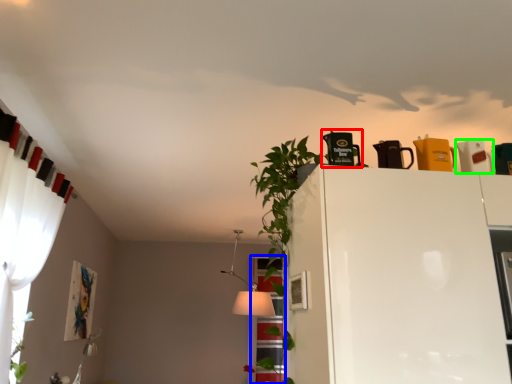
Question: Which is nearer to the appliance (highlighted by a red box)? window (highlighted by a blue box) or appliance (highlighted by a green box).

Choices:
 (A) window
 (B) appliance

Answer: (B)